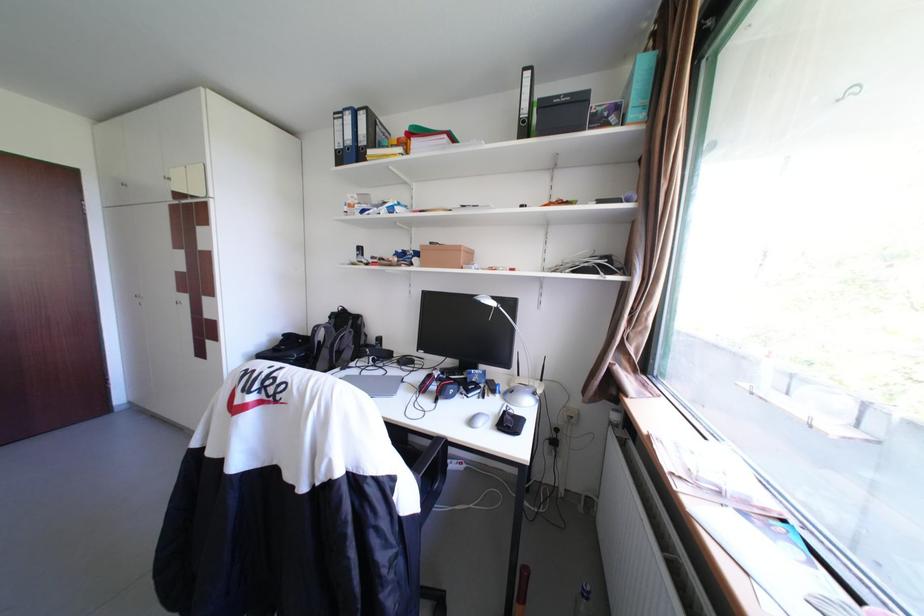
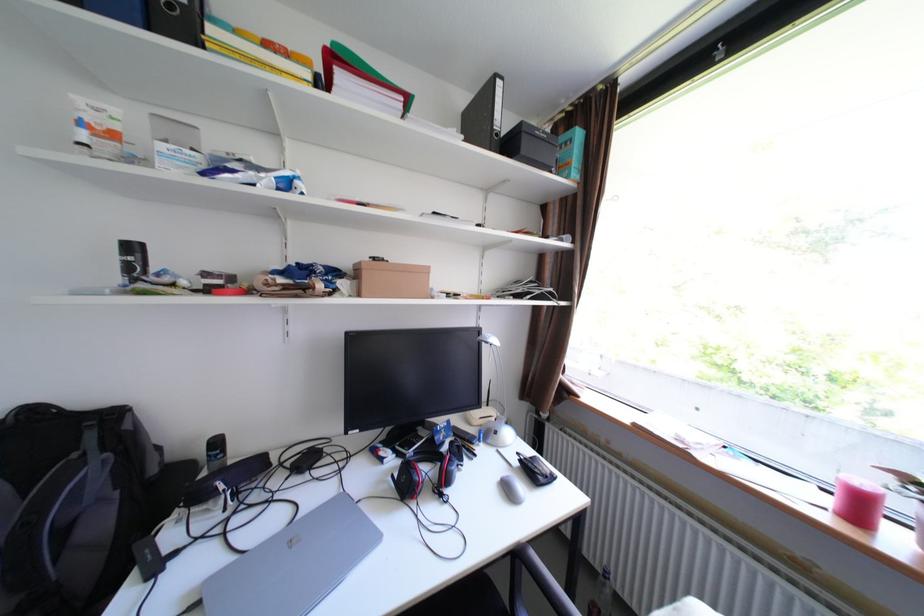
Locate, in the second image, the point that corresponds to point (535, 122) in the first image.

(507, 135)